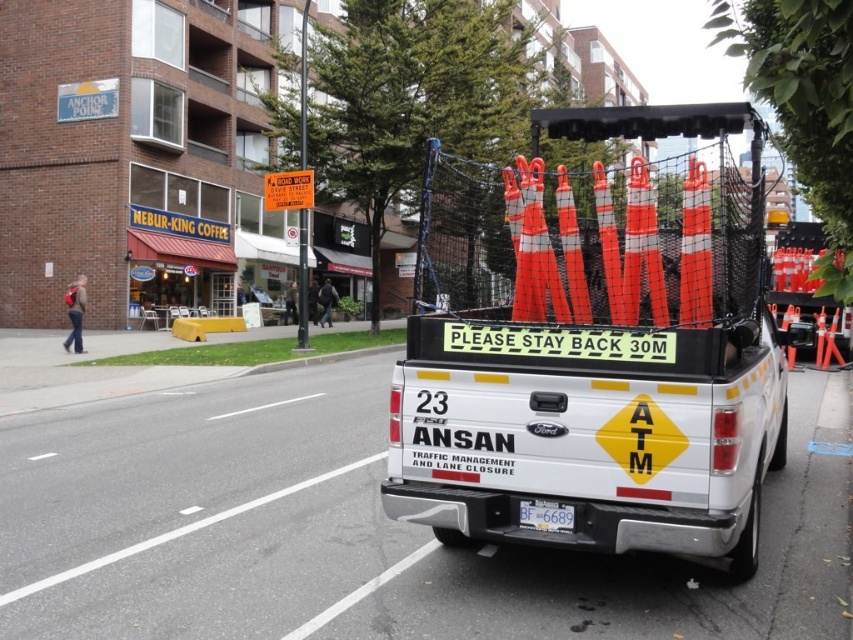
You are a driver approaching the white Ford F150 pickup truck and need to read the license plate at the center. Is the orange reflective traffic cones at rear blocking your view of the white plastic license plate at center?

The orange reflective traffic cones at rear is positioned over the white plastic license plate at center, so yes, the traffic cones are blocking the view of the license plate.

You are a driver approaching the white Ford F150 pickup truck and need to compare the height of the orange reflective traffic cones at rear and the white plastic license plate at center. Which object is taller?

The orange reflective traffic cones at rear has a greater height compared to the white plastic license plate at center, so the orange reflective traffic cones at rear is taller.